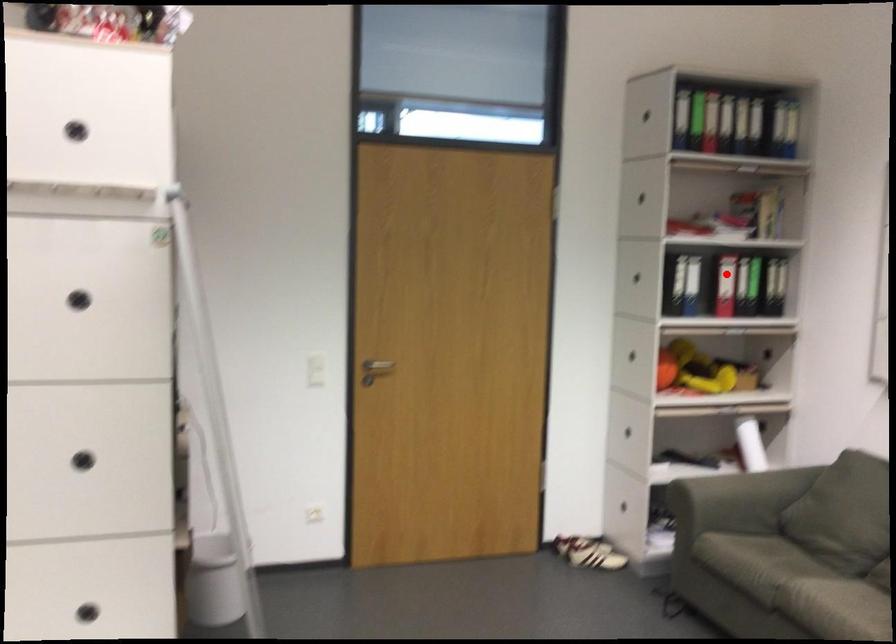
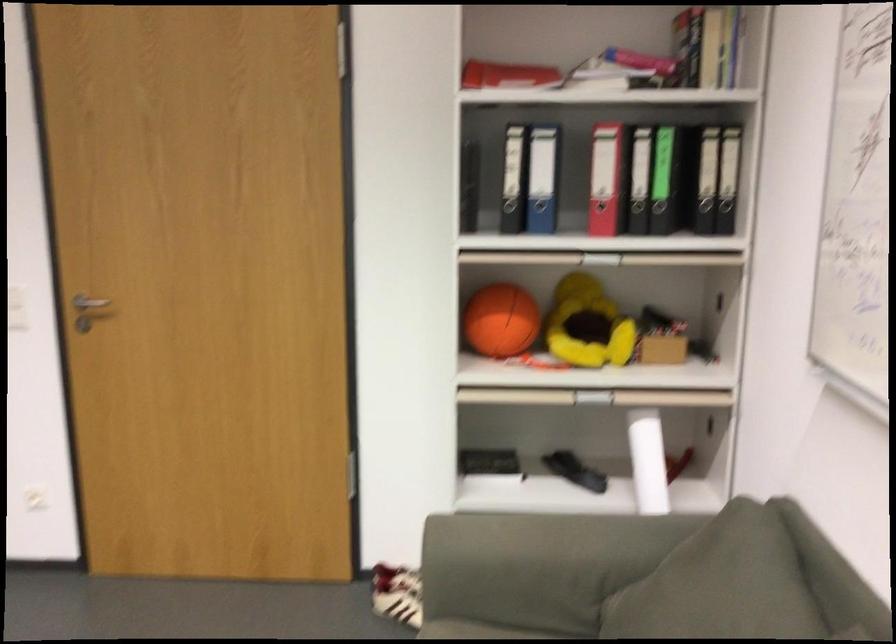
In the second image, find the point that corresponds to the highlighted location in the first image.

(606, 178)